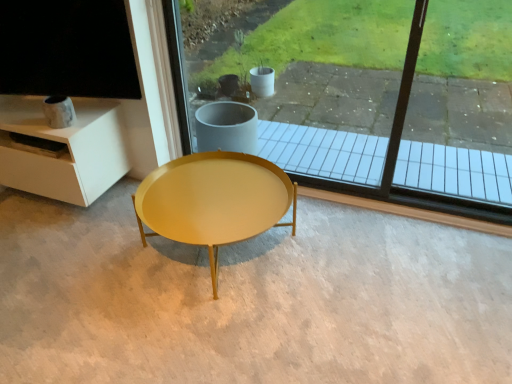
In order to face transparent glass window at center, should I rotate leftwards or rightwards?

To face it directly, rotate right by 3.187 degrees.

What do you see at coordinates (357, 92) in the screenshot? I see `transparent glass window at center` at bounding box center [357, 92].

Where is `transparent glass window at center`? transparent glass window at center is located at coordinates (357, 92).

Describe the element at coordinates (214, 201) in the screenshot. This screenshot has width=512, height=384. I see `matte yellow table at center` at that location.

You are a GUI agent. You are given a task and a screenshot of the screen. Output one action in this format:
    pyautogui.click(x=<x>, y=<y>)
    Task: Click on the matte yellow table at center
    The image size is (512, 384).
    Given the screenshot: What is the action you would take?
    pyautogui.click(x=214, y=201)

At what (x,y) coordinates should I click in order to perform the action: click on transparent glass window at center. Please return your answer as a coordinate pair (x, y). The width and height of the screenshot is (512, 384). Looking at the image, I should click on (357, 92).

Can you confirm if matte yellow table at center is positioned to the right of transparent glass window at center?

No, matte yellow table at center is not to the right of transparent glass window at center.

Considering the positions of objects matte yellow table at center and transparent glass window at center in the image provided, who is behind, matte yellow table at center or transparent glass window at center?

transparent glass window at center is behind.

Considering the points (264, 161) and (419, 39), which point is behind, point (264, 161) or point (419, 39)?

The point (264, 161) is behind.

From the image's perspective, is matte yellow table at center positioned above or below transparent glass window at center?

matte yellow table at center is situated lower than transparent glass window at center in the image.

Looking at this image, from a real-world perspective, is matte yellow table at center below transparent glass window at center?

Yes, from a real-world perspective, matte yellow table at center is beneath transparent glass window at center.

In terms of width, does matte yellow table at center look wider or thinner when compared to transparent glass window at center?

In the image, matte yellow table at center appears to be wider than transparent glass window at center.

Considering the sizes of matte yellow table at center and transparent glass window at center in the image, is matte yellow table at center taller or shorter than transparent glass window at center?

Considering their sizes, matte yellow table at center has less height than transparent glass window at center.

Which of these two, matte yellow table at center or transparent glass window at center, is bigger?

With larger size is matte yellow table at center.

Is transparent glass window at center located within matte yellow table at center?

No.

Would you consider matte yellow table at center to be distant from transparent glass window at center?

Absolutely, matte yellow table at center is distant from transparent glass window at center.

Consider the image. Is matte yellow table at center turned away from transparent glass window at center?

Correct, matte yellow table at center is looking away from transparent glass window at center.

Measure the distance from matte yellow table at center to transparent glass window at center.

The distance of matte yellow table at center from transparent glass window at center is 1.34 meters.

The image size is (512, 384). I want to click on coffee table that is under the transparent glass window at center (from a real-world perspective), so click(x=214, y=201).

Is transparent glass window at center to the left or to the right of matte yellow table at center in the image?

From the image, it's evident that transparent glass window at center is to the right of matte yellow table at center.

Which object is closer to the camera taking this photo, transparent glass window at center or matte yellow table at center?

matte yellow table at center is closer to the camera.

Considering the points (344, 23) and (189, 156), which point is behind, point (344, 23) or point (189, 156)?

The point (344, 23) is farther.

In the scene shown: From the image's perspective, does transparent glass window at center appear higher than matte yellow table at center?

Indeed, from the image's perspective, transparent glass window at center is shown above matte yellow table at center.

From a real-world perspective, which object rests below the other?

matte yellow table at center is physically lower.

Is transparent glass window at center wider than matte yellow table at center?

No.

Between transparent glass window at center and matte yellow table at center, which one has less height?

Standing shorter between the two is matte yellow table at center.

Between transparent glass window at center and matte yellow table at center, which one has larger size?

matte yellow table at center is bigger.

Is transparent glass window at center surrounding matte yellow table at center?

That's incorrect, matte yellow table at center is not inside transparent glass window at center.

Is the surface of transparent glass window at center in direct contact with matte yellow table at center?

No.

Is matte yellow table at center at the back of transparent glass window at center?

No, transparent glass window at center is not facing the opposite direction of matte yellow table at center.

Can you tell me how much transparent glass window at center and matte yellow table at center differ in facing direction?

The angle between the facing direction of transparent glass window at center and the facing direction of matte yellow table at center is 0.892 degrees.

Where is `coffee table below the transparent glass window at center (from a real-world perspective)`? The width and height of the screenshot is (512, 384). coffee table below the transparent glass window at center (from a real-world perspective) is located at coordinates (214, 201).

Identify the location of window located above the matte yellow table at center (from a real-world perspective). The width and height of the screenshot is (512, 384). (357, 92).

At what (x,y) coordinates should I click in order to perform the action: click on coffee table in front of the transparent glass window at center. Please return your answer as a coordinate pair (x, y). Looking at the image, I should click on (214, 201).